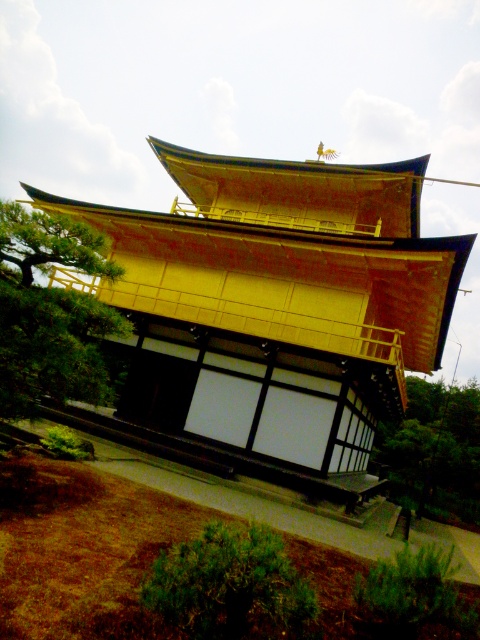
Is green leafy tree at left smaller than green leafy bush at lower center?

No.

Between point (59, 300) and point (286, 637), which one is positioned behind?

Point (59, 300)

At what (x,y) coordinates should I click in order to perform the action: click on green leafy tree at left. Please return your answer as a coordinate pair (x, y). Looking at the image, I should click on (50, 312).

Between gold lacquered wood temple at center and green leafy bush at lower center, which one has more height?

gold lacquered wood temple at center

Is point (346, 417) positioned after point (178, 584)?

Yes.

Find the location of a particular element. Image resolution: width=480 pixels, height=640 pixels. gold lacquered wood temple at center is located at coordinates (276, 307).

Based on the photo, which of these two, green leafy bush at lower center or green leafy tree at lower right, stands taller?

With more height is green leafy tree at lower right.

Which of these two, green leafy bush at lower center or green leafy tree at lower right, stands shorter?

green leafy bush at lower center is shorter.

Where is `green leafy bush at lower center`? The width and height of the screenshot is (480, 640). green leafy bush at lower center is located at coordinates (230, 586).

What are the coordinates of `green leafy bush at lower center` in the screenshot? It's located at (230, 586).